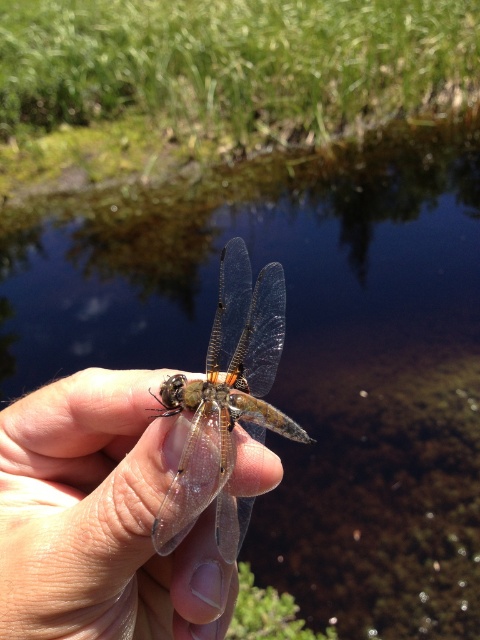
Is translucent skin at center below transparent glass dragonfly at center?

Yes.

Image resolution: width=480 pixels, height=640 pixels. I want to click on translucent skin at center, so click(100, 518).

Locate an element on the screen. The image size is (480, 640). translucent skin at center is located at coordinates (100, 518).